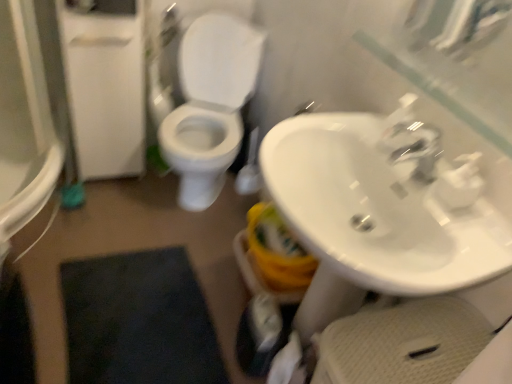
What do you see at coordinates (380, 205) in the screenshot? I see `white glossy sink at center right` at bounding box center [380, 205].

What is the approximate width of white matte toilet paper at lower center?

white matte toilet paper at lower center is 3.24 inches wide.

The width and height of the screenshot is (512, 384). In order to click on white glossy sink at center right in this screenshot , I will do (380, 205).

Which is in front, white glossy sink at center right or white glossy toilet at center?

white glossy sink at center right.

Find the location of `toilet above the white glossy sink at center right (from the image's perspective)`. toilet above the white glossy sink at center right (from the image's perspective) is located at coordinates (210, 104).

Considering the sizes of white glossy sink at center right and white glossy toilet at center in the image, is white glossy sink at center right bigger or smaller than white glossy toilet at center?

white glossy sink at center right is smaller than white glossy toilet at center.

From a real-world perspective, which object rests below the other?

white matte toilet paper at lower center, from a real-world perspective.

Does white matte toilet paper at lower center appear on the right side of white glossy toilet at center?

Yes.

From the image's perspective, which one is positioned higher, white matte toilet paper at lower center or white glossy toilet at center?

white glossy toilet at center, from the image's perspective.

How different are the orientations of white glossy toilet at center and white glossy sink at center right in degrees?

The angle between the facing direction of white glossy toilet at center and the facing direction of white glossy sink at center right is 63.8 degrees.

From the image's perspective, is white glossy toilet at center over white glossy sink at center right?

Yes, from the image's perspective, white glossy toilet at center is above white glossy sink at center right.

Who is shorter, white glossy toilet at center or white glossy sink at center right?

Standing shorter between the two is white glossy sink at center right.

Looking at their sizes, would you say white matte screen door at left is wider or thinner than white glossy sink at center right?

In the image, white matte screen door at left appears to be more narrow than white glossy sink at center right.

Locate an element on the screen. The image size is (512, 384). sink below the white matte screen door at left (from the image's perspective) is located at coordinates (380, 205).

From a real-world perspective, which object rests below the other?

white matte screen door at left is physically lower.

Is white matte screen door at left taller than white matte toilet paper at lower center?

Yes, white matte screen door at left is taller than white matte toilet paper at lower center.

Considering their positions, is white matte screen door at left located in front of or behind white matte toilet paper at lower center?

Clearly, white matte screen door at left is behind white matte toilet paper at lower center.

Would you say white matte screen door at left is outside white matte toilet paper at lower center?

Yes.

Is point (99, 80) more distant than point (292, 344)?

Yes.

Can you confirm if white glossy toilet at center is positioned to the left of white matte toilet paper at lower center?

Yes.

Is white glossy toilet at center aimed at white matte toilet paper at lower center?

No.

Choose the correct answer: Is white glossy toilet at center inside white matte toilet paper at lower center or outside it?

white glossy toilet at center lies outside white matte toilet paper at lower center.

From the image's perspective, which is below, white glossy toilet at center or white matte toilet paper at lower center?

From the image's view, white matte toilet paper at lower center is below.

Is point (289, 351) positioned in front of point (387, 223)?

No, (289, 351) is behind (387, 223).

Does white matte toilet paper at lower center appear on the left side of white glossy sink at center right?

Correct, you'll find white matte toilet paper at lower center to the left of white glossy sink at center right.

Considering the relative positions of white matte toilet paper at lower center and white glossy sink at center right in the image provided, is white matte toilet paper at lower center behind white glossy sink at center right?

Yes.

Is white matte toilet paper at lower center taller than white glossy sink at center right?

Indeed, white matte toilet paper at lower center has a greater height compared to white glossy sink at center right.

The height and width of the screenshot is (384, 512). In order to click on sink on the right of the white glossy toilet at center in this screenshot , I will do `click(380, 205)`.

The image size is (512, 384). In order to click on toilet that is behind the white matte toilet paper at lower center in this screenshot , I will do `click(210, 104)`.

Estimate the real-world distances between objects in this image. Which object is closer to white glossy toilet at center, white glossy sink at center right or white matte screen door at left?

The object closer to white glossy toilet at center is white matte screen door at left.

Estimate the real-world distances between objects in this image. Which object is closer to white glossy sink at center right, white matte toilet paper at lower center or white matte screen door at left?

white matte toilet paper at lower center.

Looking at the image, which one is located closer to white matte screen door at left, white glossy sink at center right or white glossy toilet at center?

Based on the image, white glossy toilet at center appears to be nearer to white matte screen door at left.

Estimate the real-world distances between objects in this image. Which object is further from white glossy toilet at center, white matte toilet paper at lower center or white glossy sink at center right?

The object further to white glossy toilet at center is white matte toilet paper at lower center.

Looking at this image, considering their positions, is white glossy toilet at center positioned further to white matte toilet paper at lower center than white glossy sink at center right?

white glossy toilet at center lies further to white matte toilet paper at lower center than the other object.

From the image, which object appears to be farther from white matte toilet paper at lower center, white matte screen door at left or white glossy sink at center right?

Among the two, white matte screen door at left is located further to white matte toilet paper at lower center.

From the image, which object appears to be farther from white matte screen door at left, white glossy toilet at center or white matte toilet paper at lower center?

Among the two, white matte toilet paper at lower center is located further to white matte screen door at left.

When comparing their distances from white matte screen door at left, does white glossy toilet at center or white glossy sink at center right seem further?

white glossy sink at center right lies further to white matte screen door at left than the other object.

This screenshot has width=512, height=384. I want to click on toilet between white matte screen door at left and white matte toilet paper at lower center in the vertical direction, so click(x=210, y=104).

The width and height of the screenshot is (512, 384). What are the coordinates of `toilet located between white matte screen door at left and white glossy sink at center right in the left-right direction` in the screenshot? It's located at (210, 104).

This screenshot has width=512, height=384. In order to click on sink between white matte screen door at left and white matte toilet paper at lower center in the vertical direction in this screenshot , I will do 380,205.

This screenshot has width=512, height=384. I want to click on sink between white glossy toilet at center and white matte toilet paper at lower center in the up-down direction, so click(x=380, y=205).